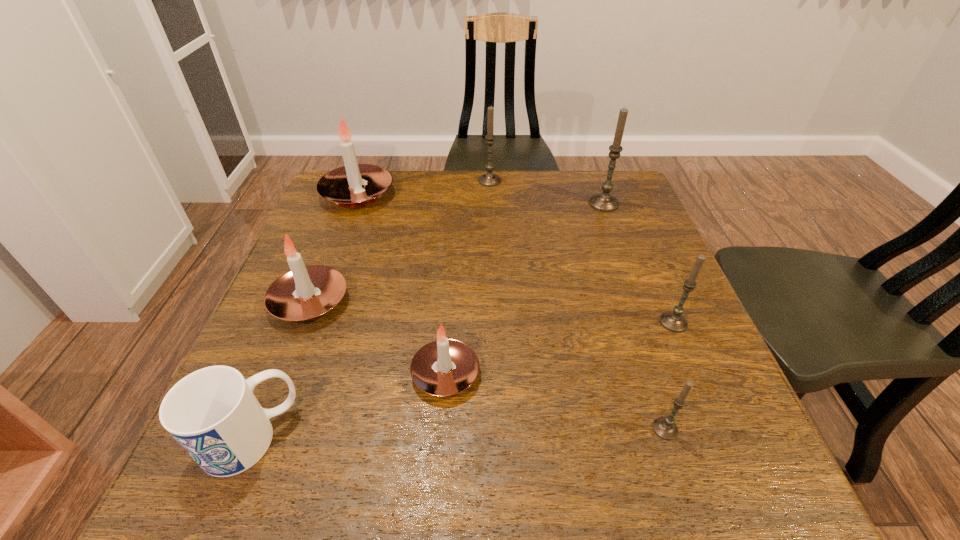
Find the location of `free spot at the far right corner of the desktop`. free spot at the far right corner of the desktop is located at coordinates (588, 210).

Where is `vacant space at the near right corner of the desktop`? This screenshot has height=540, width=960. vacant space at the near right corner of the desktop is located at coordinates (669, 472).

The image size is (960, 540). Identify the location of free space between the third biggest gray candle and the smallest white candle. (560, 348).

The height and width of the screenshot is (540, 960). In order to click on free spot between the nearest white candle and the second biggest white candle in this screenshot , I will do `click(377, 338)`.

Locate an element on the screen. The width and height of the screenshot is (960, 540). free point between the biggest white candle and the second nearest white candle is located at coordinates (334, 248).

Find the location of a particular element. The image size is (960, 540). vacant space that's between the smallest white candle and the third farthest gray candle is located at coordinates (560, 348).

At what (x,y) coordinates should I click in order to perform the action: click on vacant space that is in between the tallest candle and the second nearest gray candle. Please return your answer as a coordinate pair (x, y). Looking at the image, I should click on (638, 263).

Find the location of a particular element. free space between the nearest candle and the tallest candle is located at coordinates click(635, 316).

Locate an element on the screen. Image resolution: width=960 pixels, height=540 pixels. unoccupied area between the tallest candle and the biggest white candle is located at coordinates (481, 199).

At what (x,y) coordinates should I click in order to perform the action: click on free space between the rightmost white candle and the biggest gray candle. Please return your answer as a coordinate pair (x, y). The image size is (960, 540). Looking at the image, I should click on (525, 288).